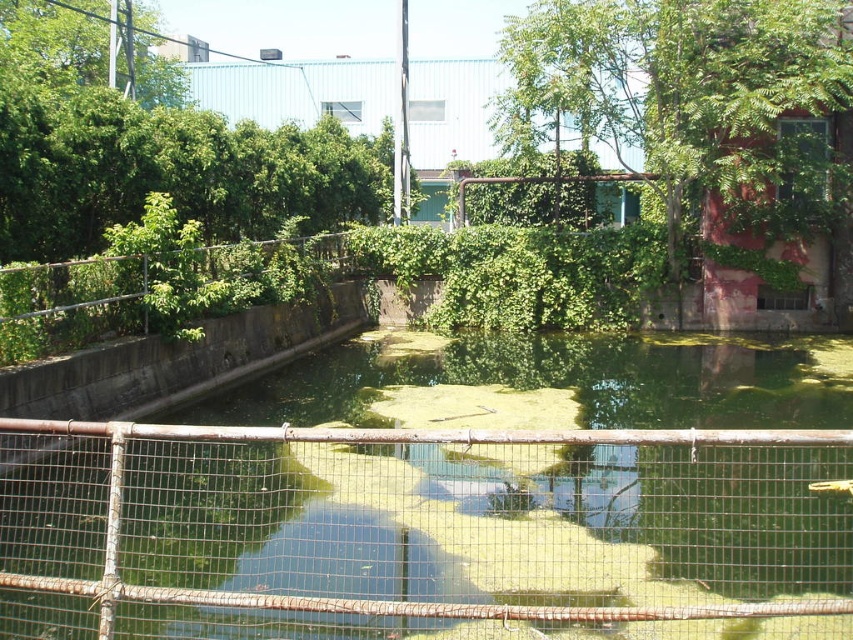
Question: Does green algae water at center appear on the left side of rusty metal fence at upper center?

Choices:
 (A) no
 (B) yes

Answer: (A)

Question: Which object is positioned farthest from the rusty metal fence at upper center?

Choices:
 (A) green leafy tree at upper right
 (B) green leafy tree at upper left

Answer: (A)

Question: Based on their relative distances, which object is farther from the rusty metal fence at upper center?

Choices:
 (A) green algae water at center
 (B) green leafy tree at upper right

Answer: (B)

Question: Which object is positioned farthest from the green algae water at center?

Choices:
 (A) green leafy tree at upper left
 (B) green leafy tree at upper right

Answer: (A)

Question: Can you confirm if green leafy tree at upper right is smaller than rusty metal fence at upper center?

Choices:
 (A) yes
 (B) no

Answer: (B)

Question: Is green algae water at center closer to camera compared to green leafy tree at upper right?

Choices:
 (A) no
 (B) yes

Answer: (B)